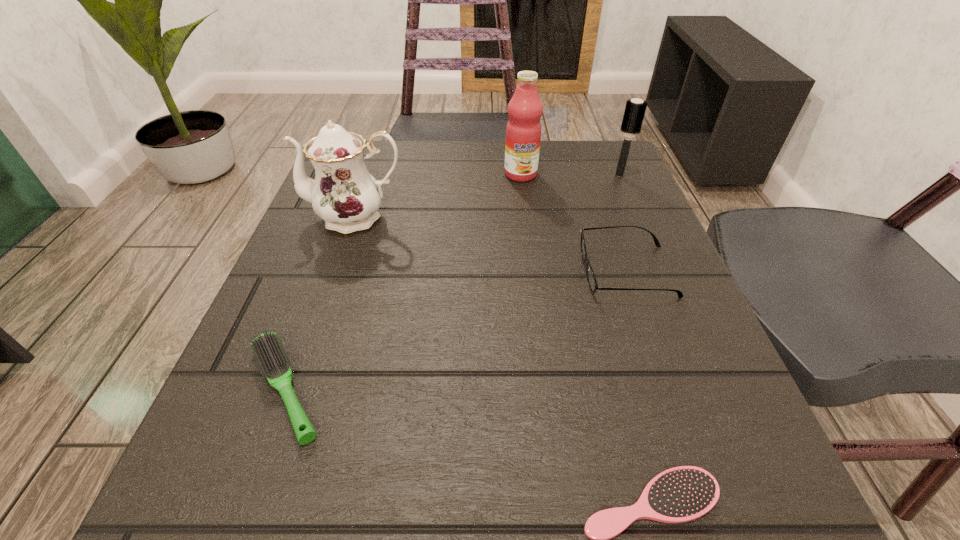
Find the location of a particular element. The width and height of the screenshot is (960, 540). spectacles present at the right edge is located at coordinates (591, 279).

This screenshot has width=960, height=540. What are the coordinates of `object at the far left corner` in the screenshot? It's located at (344, 194).

You are a GUI agent. You are given a task and a screenshot of the screen. Output one action in this format:
    pyautogui.click(x=<x>, y=<y>)
    Task: Click on the object positioned at the far right corner
    The height and width of the screenshot is (540, 960).
    Given the screenshot: What is the action you would take?
    pyautogui.click(x=635, y=109)

In the image, there is a desktop. Identify the location of vacant space at the far edge. The image size is (960, 540). (420, 169).

At what (x,y) coordinates should I click in order to perform the action: click on vacant space at the near edge. Please return your answer as a coordinate pair (x, y). The image size is (960, 540). Looking at the image, I should click on (420, 522).

You are a GUI agent. You are given a task and a screenshot of the screen. Output one action in this format:
    pyautogui.click(x=<x>, y=<y>)
    Task: Click on the free space at the left edge
    The image size is (960, 540).
    Given the screenshot: What is the action you would take?
    pyautogui.click(x=301, y=260)

This screenshot has height=540, width=960. I want to click on vacant area at the right edge of the desktop, so click(660, 353).

At what (x,y) coordinates should I click in order to perform the action: click on free space at the far left corner of the desktop. Please return your answer as a coordinate pair (x, y). Looking at the image, I should click on (378, 141).

This screenshot has height=540, width=960. In the image, there is a desktop. Find the location of `vacant space at the near left corner`. vacant space at the near left corner is located at coordinates (315, 479).

Where is `vacant space at the far right corner`? The height and width of the screenshot is (540, 960). vacant space at the far right corner is located at coordinates (550, 146).